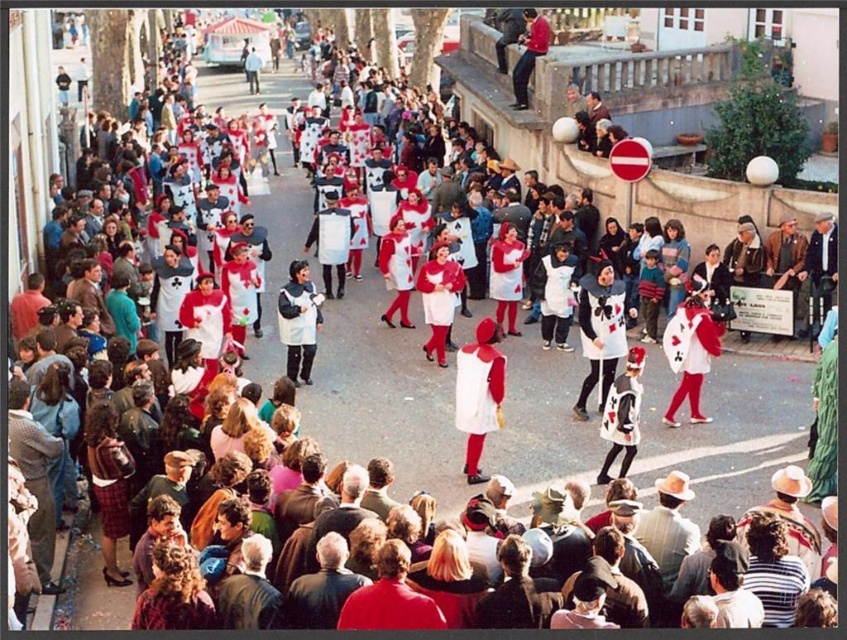
Question: Which object appears closest to the camera in this image?

Choices:
 (A) blonde hair at center
 (B) denim jacket at lower left

Answer: (A)

Question: Where is blonde hair at center located in relation to matte white dress at center in the image?

Choices:
 (A) right
 (B) left

Answer: (A)

Question: Is matte red coat at lower left further to the viewer compared to denim jacket at lower left?

Choices:
 (A) yes
 (B) no

Answer: (B)

Question: Which object is the farthest from the denim jacket at lower left?

Choices:
 (A) plaid skirt at lower left
 (B) matte red coat at lower left
 (C) matte white dress at center

Answer: (C)

Question: Does plaid skirt at lower left appear over denim jacket at lower left?

Choices:
 (A) yes
 (B) no

Answer: (B)

Question: Estimate the real-world distances between objects in this image. Which object is farther from the denim jacket at lower left?

Choices:
 (A) matte white dress at center
 (B) plaid skirt at lower left

Answer: (A)